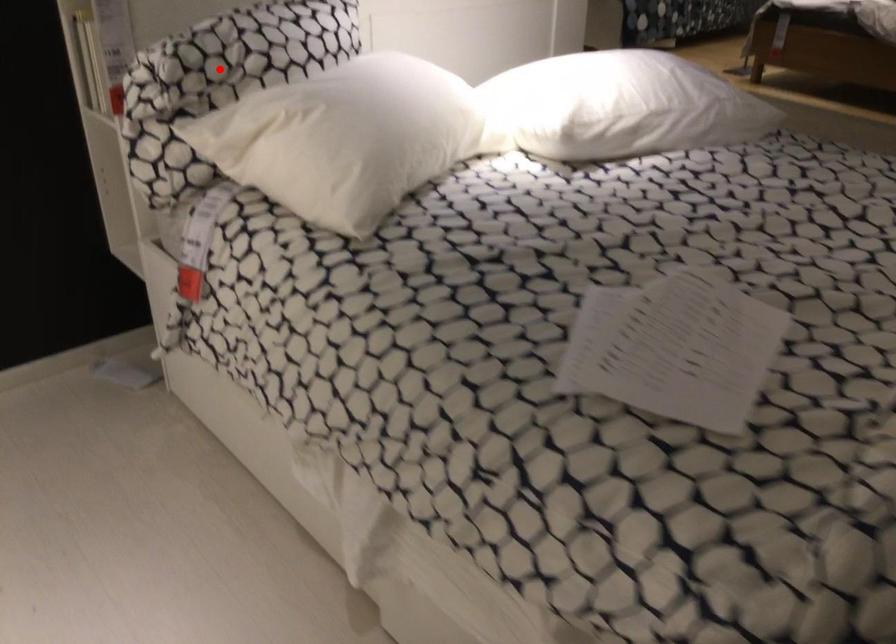
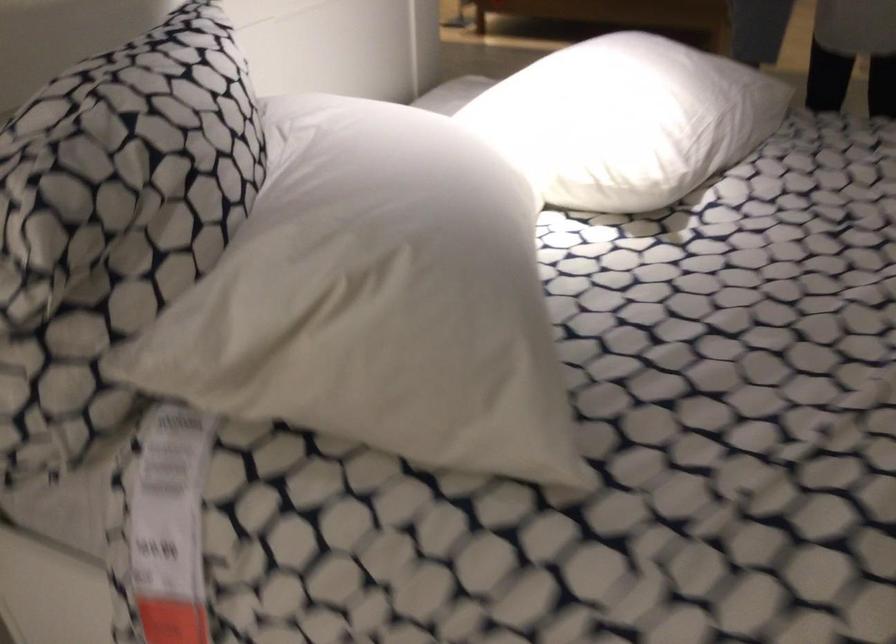
The point at the highlighted location is marked in the first image. Where is the corresponding point in the second image?

(116, 205)